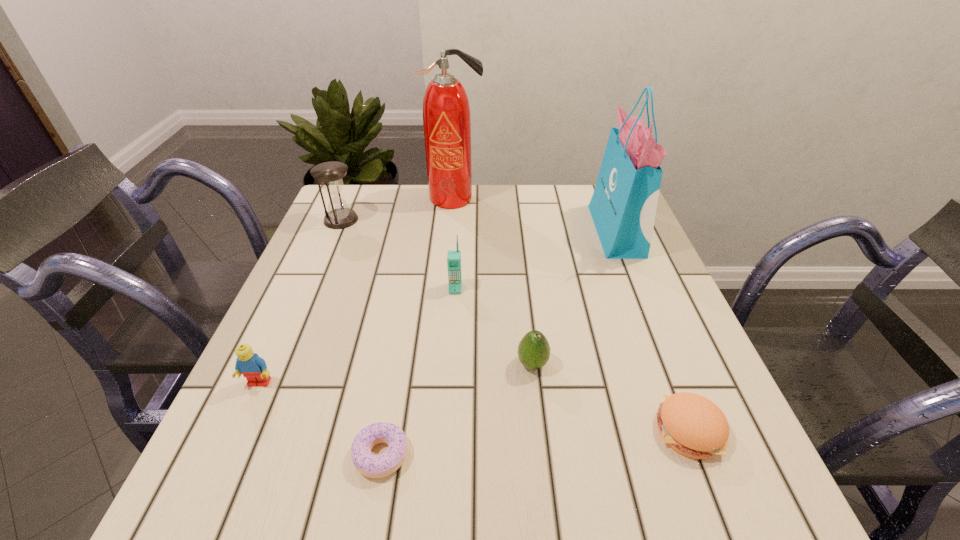
Locate an element on the screen. Image resolution: width=960 pixels, height=540 pixels. vacant area located on the front of the hourglass is located at coordinates (314, 285).

Identify the location of vacant region located on the keypad of the fifth nearest object. Image resolution: width=960 pixels, height=540 pixels. (x=453, y=324).

Identify the location of vacant area located 0.140m on the face of the Lego. (223, 465).

You are a GUI agent. You are given a task and a screenshot of the screen. Output one action in this format:
    pyautogui.click(x=<x>, y=<y>)
    Task: Click on the vacant space located on the back of the third object from right to left
    Image resolution: width=960 pixels, height=540 pixels.
    Given the screenshot: What is the action you would take?
    pyautogui.click(x=528, y=326)

At what (x,y) coordinates should I click in order to perform the action: click on free space located on the left of the seventh tallest object. Please return your answer as a coordinate pair (x, y). Image resolution: width=960 pixels, height=540 pixels. Looking at the image, I should click on (446, 429).

The height and width of the screenshot is (540, 960). In order to click on vacant space situated 0.230m on the left of the shortest object in this screenshot , I will do `click(210, 455)`.

Where is `fire extinguisher present at the far edge`? fire extinguisher present at the far edge is located at coordinates (446, 112).

The height and width of the screenshot is (540, 960). I want to click on shopping bag present at the far edge, so click(x=623, y=207).

Identify the location of hourglass that is at the far edge. Image resolution: width=960 pixels, height=540 pixels. (330, 174).

The image size is (960, 540). I want to click on patty situated at the near edge, so click(x=692, y=425).